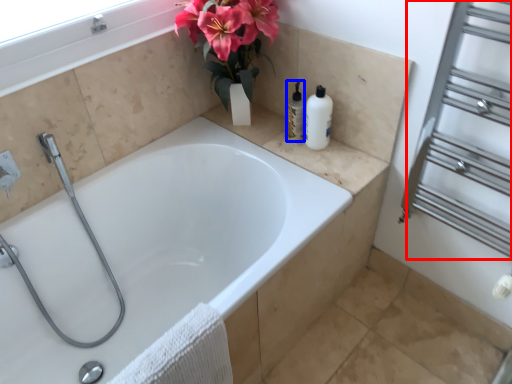
Question: Which point is further to the camera, screen door (highlighted by a red box) or toiletry (highlighted by a blue box)?

Choices:
 (A) screen door
 (B) toiletry

Answer: (B)